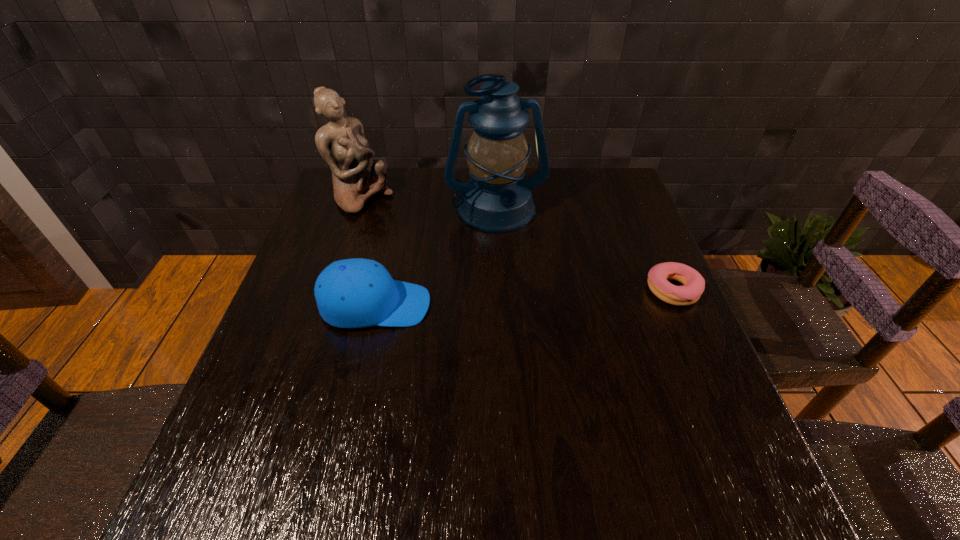
You are a GUI agent. You are given a task and a screenshot of the screen. Output one action in this format:
    pyautogui.click(x=<x>, y=<y>)
    Task: Click on the third tallest object
    
    Given the screenshot: What is the action you would take?
    pyautogui.click(x=355, y=293)

Locate an element on the screen. the shortest object is located at coordinates (693, 283).

Identify the location of doughnut. Image resolution: width=960 pixels, height=540 pixels. (693, 283).

The image size is (960, 540). What are the coordinates of `lantern` in the screenshot? It's located at (496, 200).

Identify the location of the third object from left to right. (496, 200).

The image size is (960, 540). What are the coordinates of `figurine` in the screenshot? It's located at (356, 177).

You are a GUI agent. You are given a task and a screenshot of the screen. Output one action in this format:
    pyautogui.click(x=<x>, y=<y>)
    Task: Click on the vacant region located on the front-facing side of the cap
    
    Given the screenshot: What is the action you would take?
    pyautogui.click(x=513, y=305)

This screenshot has width=960, height=540. In order to click on vacant space located on the left of the doughnut in this screenshot , I will do `click(580, 290)`.

The image size is (960, 540). I want to click on free space located on the face of the lantern, so click(x=518, y=291).

The image size is (960, 540). In order to click on free space located on the face of the lantern in this screenshot , I will do `click(515, 276)`.